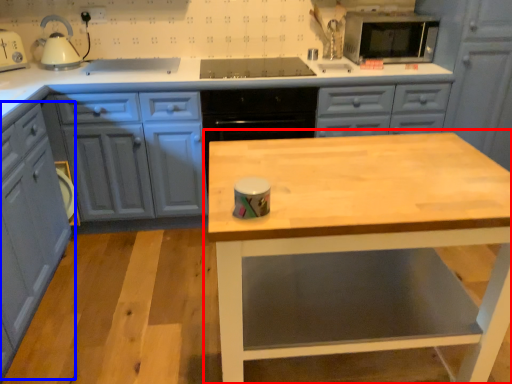
Question: Which object is further to the camera taking this photo, table (highlighted by a red box) or cabinetry (highlighted by a blue box)?

Choices:
 (A) table
 (B) cabinetry

Answer: (B)